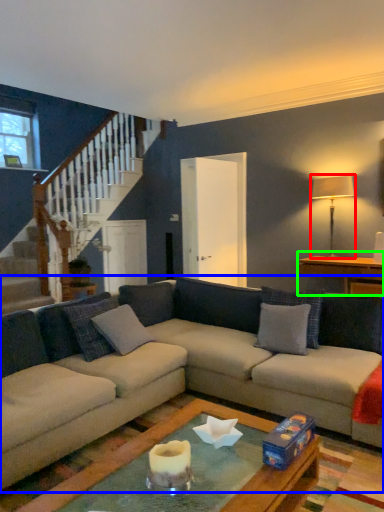
Question: Which object is the closest to the lamp (highlighted by a red box)? Choose among these: studio couch (highlighted by a blue box) or table (highlighted by a green box).

Choices:
 (A) studio couch
 (B) table

Answer: (B)